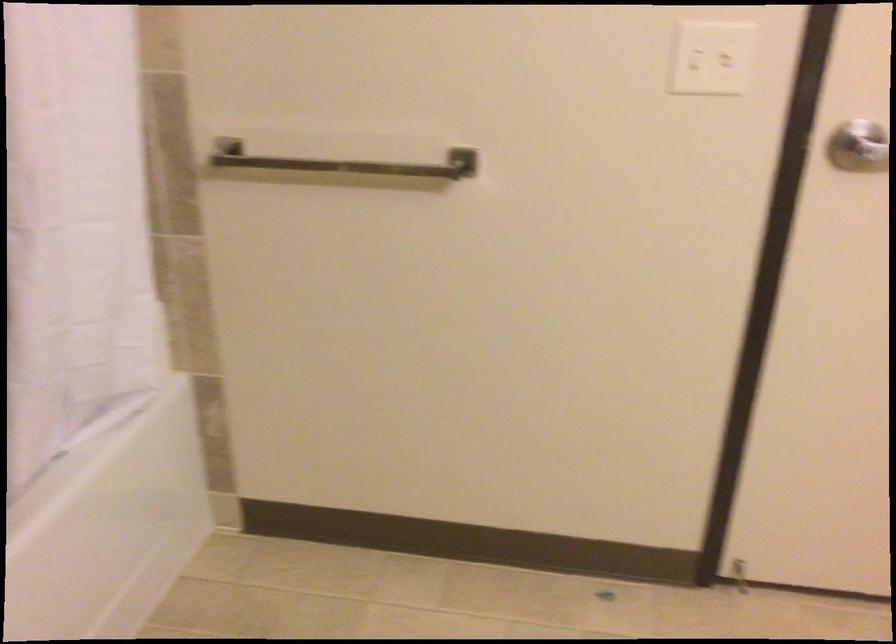
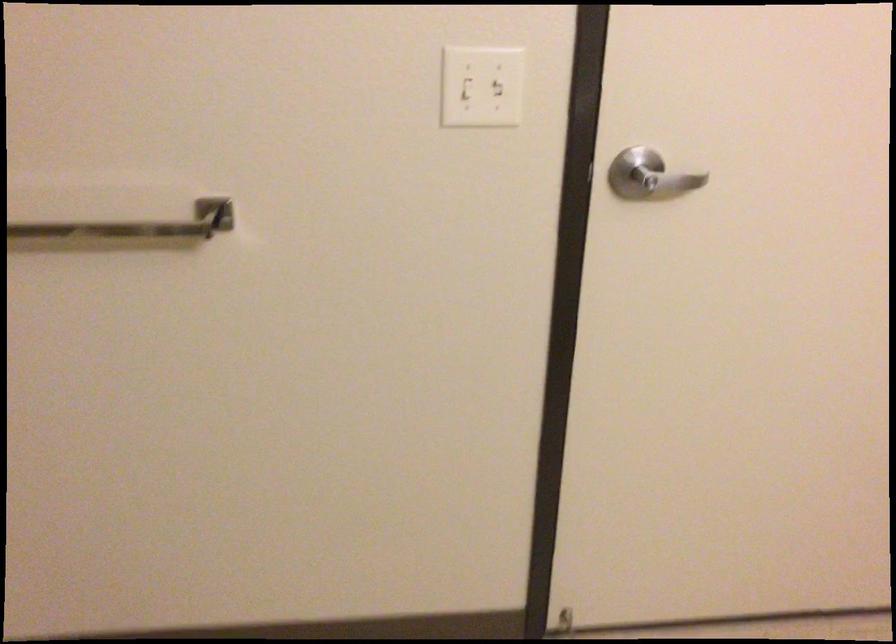
Question: What movement of the cameraman would produce the second image?

Choices:
 (A) Left
 (B) Right
 (C) Forward
 (D) Backward

Answer: (C)